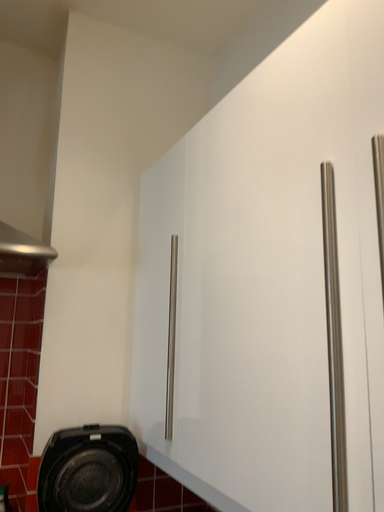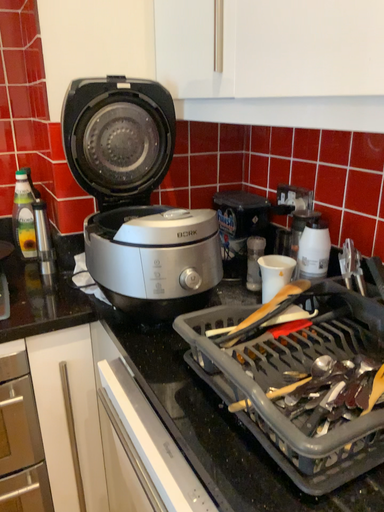
Question: Which way did the camera rotate in the video?

Choices:
 (A) rotated downward
 (B) rotated upward

Answer: (A)